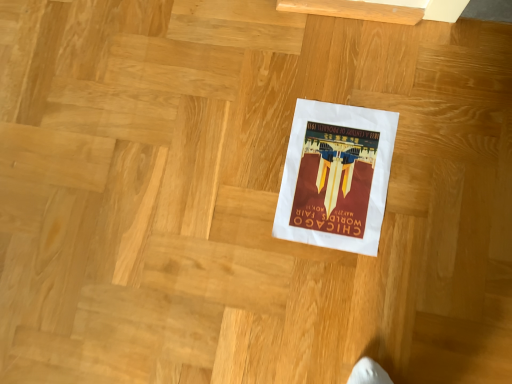
What are the coordinates of `free location above white paper at center (from a real-world perspective)` in the screenshot? It's located at (226, 178).